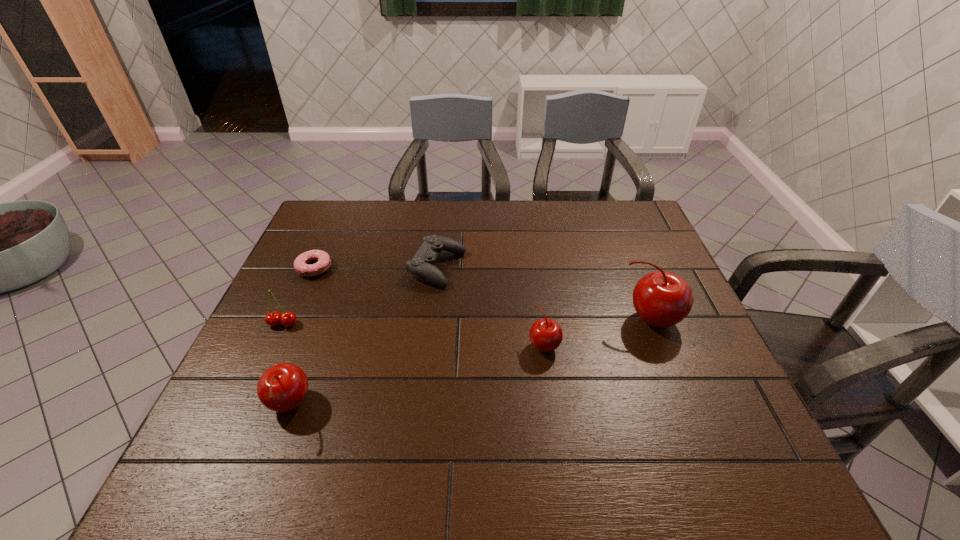
To make them evenly spaced by inserting another cherry among them, please locate a free space for this new cherry. Please provide its 2D coordinates. Your answer should be formatted as a tuple, i.e. [(x, y)], where the tuple contains the x and y coordinates of a point satisfying the conditions above.

[(424, 374)]